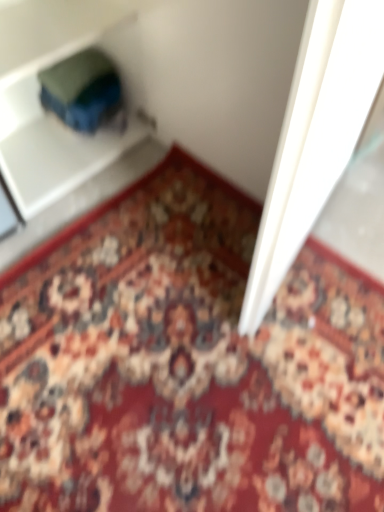
Question: Should I look upward or downward to see floral carpet at center?

Choices:
 (A) down
 (B) up

Answer: (A)